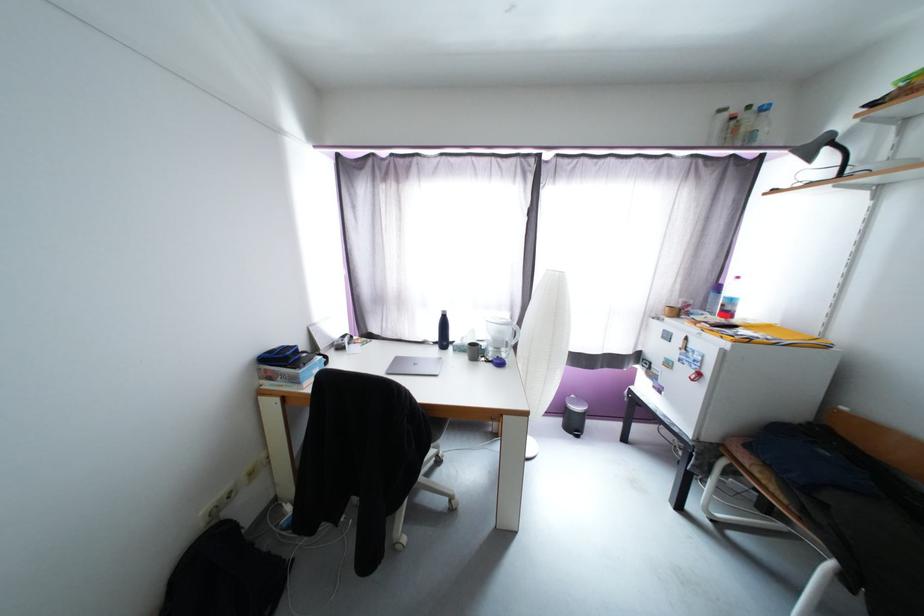
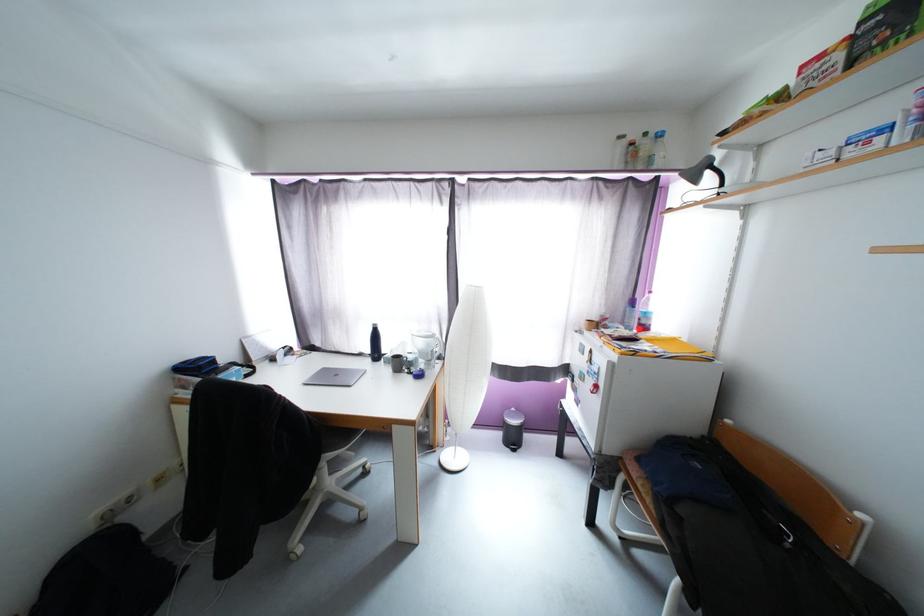
In the second image, find the point that corresponds to [456,499] in the first image.

(367, 511)